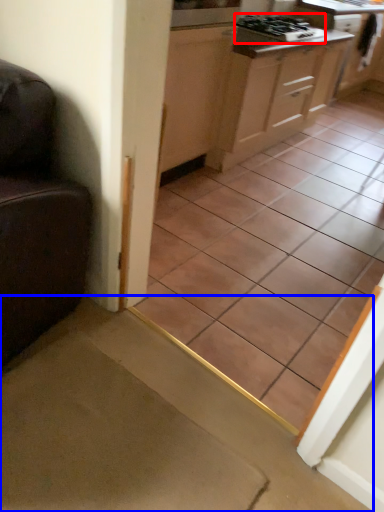
Question: Which point is closer to the camera, gas stove (highlighted by a red box) or stairwell (highlighted by a blue box)?

Choices:
 (A) gas stove
 (B) stairwell

Answer: (B)